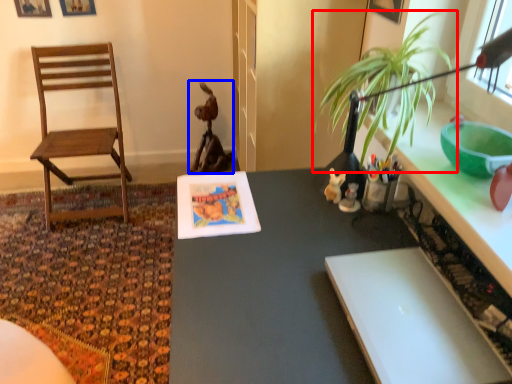
Question: Which of the following is the closest to the observer, houseplant (highlighted by a red box) or animal (highlighted by a blue box)?

Choices:
 (A) houseplant
 (B) animal

Answer: (A)